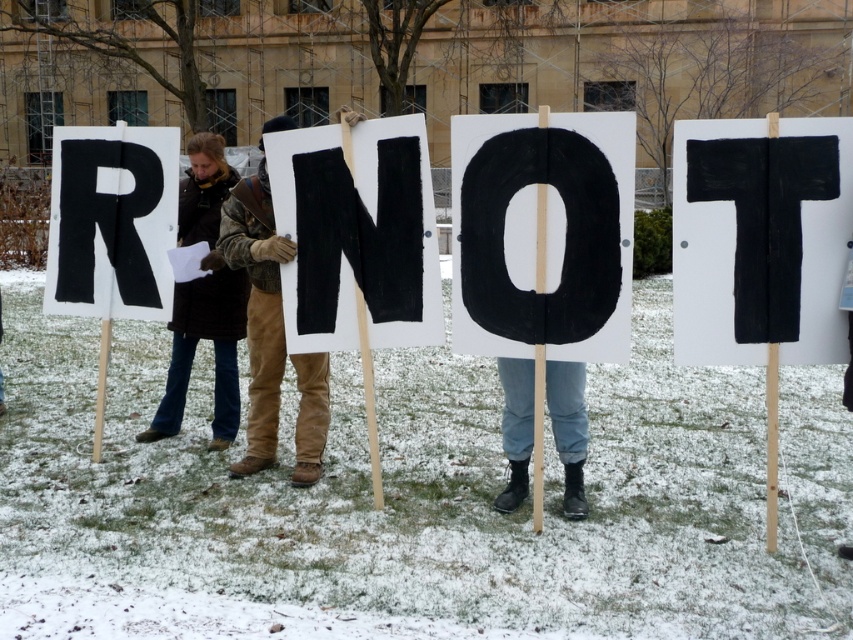
Question: Considering the relative positions of black painted sign at center and black painted wood letter r at left in the image provided, where is black painted sign at center located with respect to black painted wood letter r at left?

Choices:
 (A) above
 (B) below

Answer: (B)

Question: Does black painted wood letter r at left lie in front of brown leather gloves at center?

Choices:
 (A) no
 (B) yes

Answer: (A)

Question: Which object is positioned closest to the black painted sign at center?

Choices:
 (A) black painted wood at center
 (B) black painted wood letter r at left

Answer: (A)

Question: Which point is farther to the camera?

Choices:
 (A) (776, 316)
 (B) (262, 340)

Answer: (B)

Question: Which of the following is the farthest from the observer?

Choices:
 (A) brown leather gloves at center
 (B) black painted wood at center
 (C) black painted sign at center

Answer: (A)

Question: Is black painted sign at center wider than black painted wood at center?

Choices:
 (A) yes
 (B) no

Answer: (B)